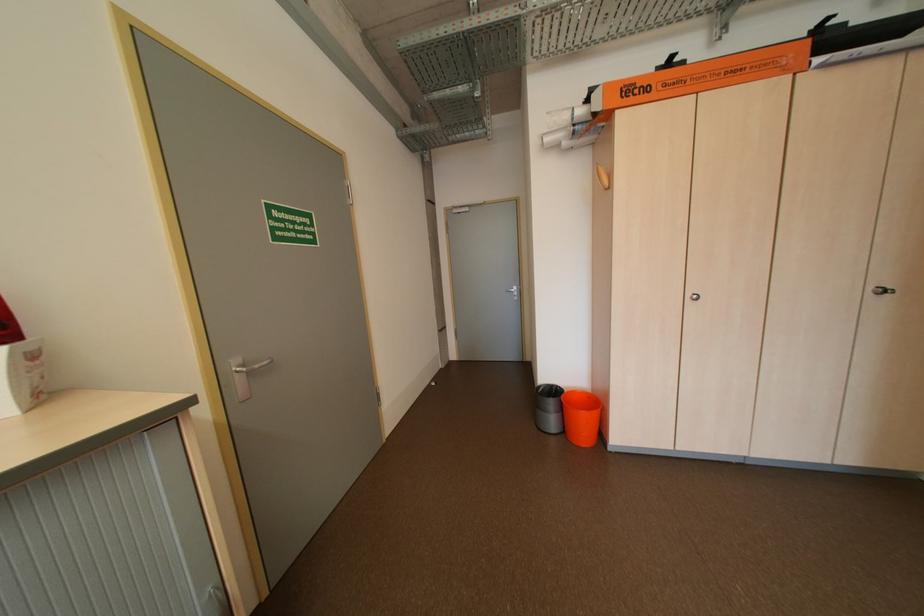
Where is `recessed cabinet handle`? Image resolution: width=924 pixels, height=616 pixels. recessed cabinet handle is located at coordinates (903, 290).